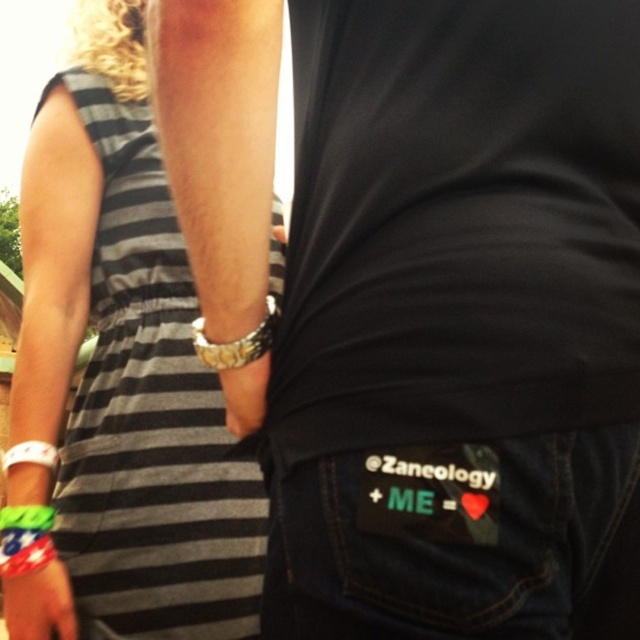
Between black striped dress at left and gold metallic watch at upper center, which one is positioned lower?

Answer: black striped dress at left is below.

Which is in front, point (237, 604) or point (275, 316)?

Point (275, 316)

Find the location of a particular element. This screenshot has height=640, width=640. black striped dress at left is located at coordinates (150, 419).

Does black striped dress at left appear on the left side of white rubber bracelet at lower left?

In fact, black striped dress at left is to the right of white rubber bracelet at lower left.

Does black striped dress at left have a lesser width compared to white rubber bracelet at lower left?

No, black striped dress at left is not thinner than white rubber bracelet at lower left.

Which is in front, point (214, 609) or point (51, 449)?

Point (51, 449) is more forward.

Where is `black striped dress at left`? black striped dress at left is located at coordinates (150, 419).

Can you confirm if rubber wristband at lower left is bigger than white rubber bracelet at lower left?

Result: Indeed, rubber wristband at lower left has a larger size compared to white rubber bracelet at lower left.

Who is shorter, rubber wristband at lower left or white rubber bracelet at lower left?

Standing shorter between the two is white rubber bracelet at lower left.

Describe the element at coordinates (38, 604) in the screenshot. I see `rubber wristband at lower left` at that location.

At what (x,y) coordinates should I click in order to perform the action: click on rubber wristband at lower left. Please return your answer as a coordinate pair (x, y). This screenshot has height=640, width=640. Looking at the image, I should click on (38, 604).